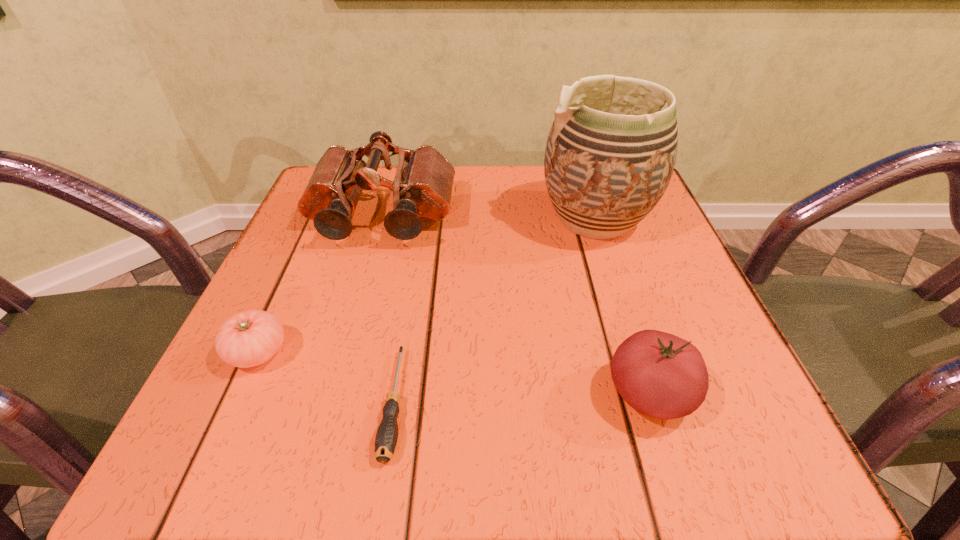
Where is `object at the far left corner`? object at the far left corner is located at coordinates click(x=422, y=187).

The width and height of the screenshot is (960, 540). Identify the location of object located at the far right corner. (610, 154).

The width and height of the screenshot is (960, 540). I want to click on object located in the near right corner section of the desktop, so pyautogui.click(x=660, y=375).

Where is `free space at the far edge`? The width and height of the screenshot is (960, 540). free space at the far edge is located at coordinates (521, 206).

This screenshot has height=540, width=960. In the image, there is a desktop. In order to click on free space at the left edge in this screenshot , I will do pos(360,232).

Locate an element on the screen. Image resolution: width=960 pixels, height=540 pixels. blank space at the right edge of the desktop is located at coordinates (658, 316).

You are a GUI agent. You are given a task and a screenshot of the screen. Output one action in this format:
    pyautogui.click(x=<x>, y=<y>)
    Task: Click on the vacant position at the far left corner of the desktop
    
    Given the screenshot: What is the action you would take?
    pyautogui.click(x=391, y=178)

Locate an element on the screen. vacant space at the near left corner is located at coordinates (236, 460).

Locate an element on the screen. Image resolution: width=960 pixels, height=540 pixels. vacant space in between the binoculars and the shortest object is located at coordinates (389, 310).

Where is `free spot between the binoculars and the second shortest object`? free spot between the binoculars and the second shortest object is located at coordinates (320, 285).